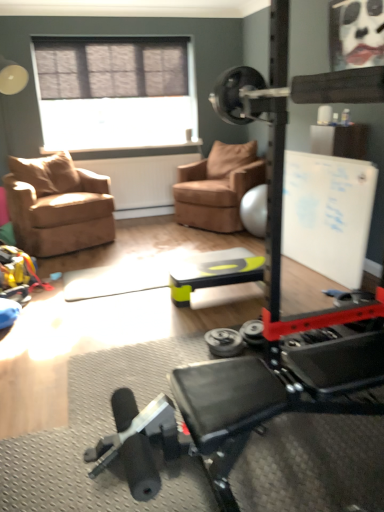
Question: Is silver metallic dumbbell at center shorter than matte black face at upper right?

Choices:
 (A) no
 (B) yes

Answer: (B)

Question: Is the surface of silver metallic dumbbell at center in direct contact with matte black face at upper right?

Choices:
 (A) no
 (B) yes

Answer: (A)

Question: Can you confirm if silver metallic dumbbell at center is smaller than matte black face at upper right?

Choices:
 (A) no
 (B) yes

Answer: (B)

Question: From a real-world perspective, is silver metallic dumbbell at center located beneath matte black face at upper right?

Choices:
 (A) no
 (B) yes

Answer: (B)

Question: Does silver metallic dumbbell at center come behind matte black face at upper right?

Choices:
 (A) no
 (B) yes

Answer: (A)

Question: From the image's perspective, would you say silver metallic dumbbell at center is shown under matte black face at upper right?

Choices:
 (A) no
 (B) yes

Answer: (B)

Question: Could you tell me if white matte bulletin board at upper right is turned towards green plastic table at center?

Choices:
 (A) no
 (B) yes

Answer: (B)

Question: Can you confirm if white matte bulletin board at upper right is positioned to the right of green plastic table at center?

Choices:
 (A) no
 (B) yes

Answer: (B)

Question: From a real-world perspective, is white matte bulletin board at upper right on top of green plastic table at center?

Choices:
 (A) no
 (B) yes

Answer: (B)

Question: Is white matte bulletin board at upper right surrounding green plastic table at center?

Choices:
 (A) yes
 (B) no

Answer: (B)

Question: From a real-world perspective, is white matte bulletin board at upper right physically below green plastic table at center?

Choices:
 (A) yes
 (B) no

Answer: (B)

Question: Considering the relative positions of white matte bulletin board at upper right and green plastic table at center in the image provided, is white matte bulletin board at upper right behind green plastic table at center?

Choices:
 (A) yes
 (B) no

Answer: (A)

Question: Is suede brown armchair at left, which appears as the second chair when viewed from the right, outside suede brown armchair at center, which is counted as the 2th chair, starting from the left?

Choices:
 (A) yes
 (B) no

Answer: (A)